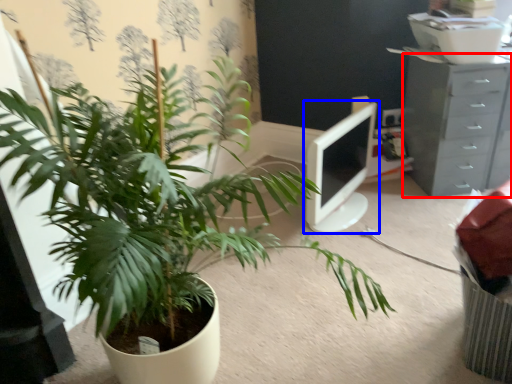
Question: Which object appears farthest to the camera in this image, chest of drawers (highlighted by a red box) or computer monitor (highlighted by a blue box)?

Choices:
 (A) chest of drawers
 (B) computer monitor

Answer: (A)